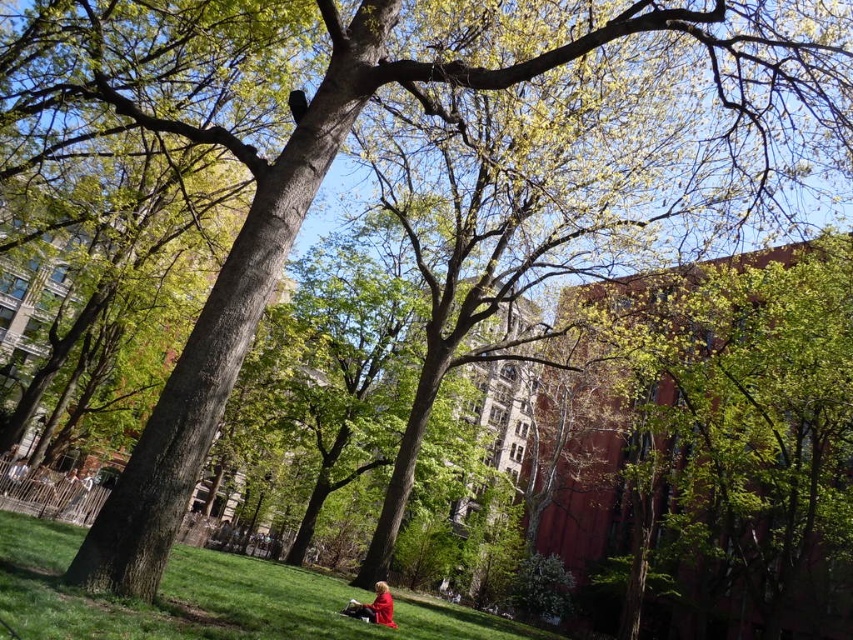
Who is positioned more to the left, green grass at lower center or red fabric person at lower center?

green grass at lower center is more to the left.

I want to click on green grass at lower center, so click(x=206, y=598).

Between point (263, 561) and point (390, 596), which one is positioned in front?

Point (390, 596) is more forward.

Where is `green grass at lower center`? The width and height of the screenshot is (853, 640). green grass at lower center is located at coordinates (206, 598).

Does green leafy tree at upper right lie in front of red fabric person at lower center?

No, it is not.

Is point (714, 481) in front of point (373, 586)?

No.

At what (x,y) coordinates should I click in order to perform the action: click on green leafy tree at upper right. Please return your answer as a coordinate pair (x, y). Looking at the image, I should click on (735, 424).

Who is positioned more to the right, green leafy tree at upper right or green grass at lower center?

From the viewer's perspective, green leafy tree at upper right appears more on the right side.

Does green leafy tree at upper right have a greater height compared to green grass at lower center?

Yes, green leafy tree at upper right is taller than green grass at lower center.

The height and width of the screenshot is (640, 853). What do you see at coordinates (735, 424) in the screenshot? I see `green leafy tree at upper right` at bounding box center [735, 424].

Locate an element on the screen. green leafy tree at upper right is located at coordinates (735, 424).